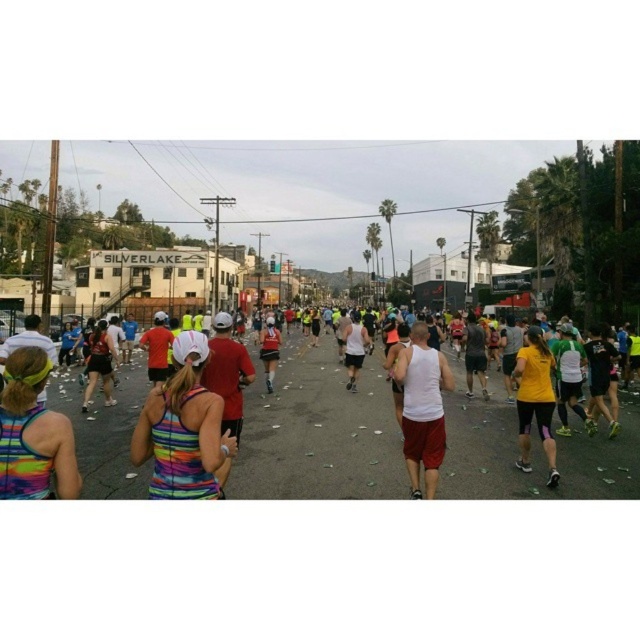
You are a photographer positioned at the center of the marathon street. You want to capture a photo that includes both the multicolored tank top at center and the yellow fabric at right. Given that your camera has a maximum focus range of 12 feet, will you be able to get both subjects in focus?

The multicolored tank top at center and yellow fabric at right are 12.86 feet apart. Since the distance between them exceeds the camera maximum focus range of 12 feet, you won not be able to get both subjects in focus.

You are a photographer positioned at the starting line of the marathon. You want to capture a photo that includes both the multicolored fabric tank top at center and the yellow fabric at right. Based on their widths, which object should you adjust your camera angle to focus on first to ensure both are in frame?

The multicolored fabric tank top at center might be wider than yellow fabric at right, so you should focus on the multicolored fabric tank top at center first to ensure it fits within the frame.

Consider the image. You are a photographer standing on the sidewalk. You want to take a photo of the multicolored fabric tank top at center and the yellow fabric at right. Which object should you focus on first if you want to capture both in the frame without moving the camera?

You should focus on the multicolored fabric tank top at center first because it is to the left of the yellow fabric at right, so by centering the frame on the multicolored one, you can include both in the shot.